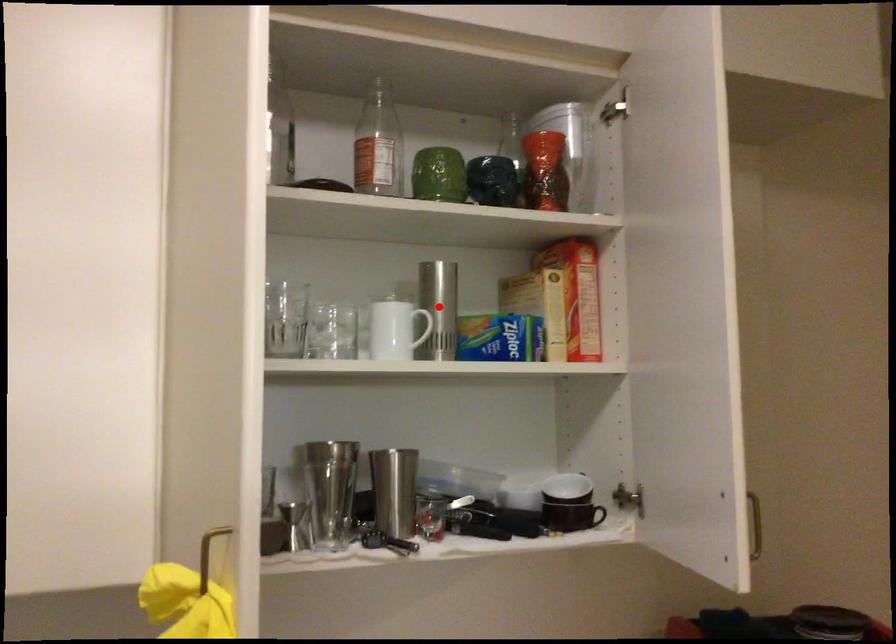
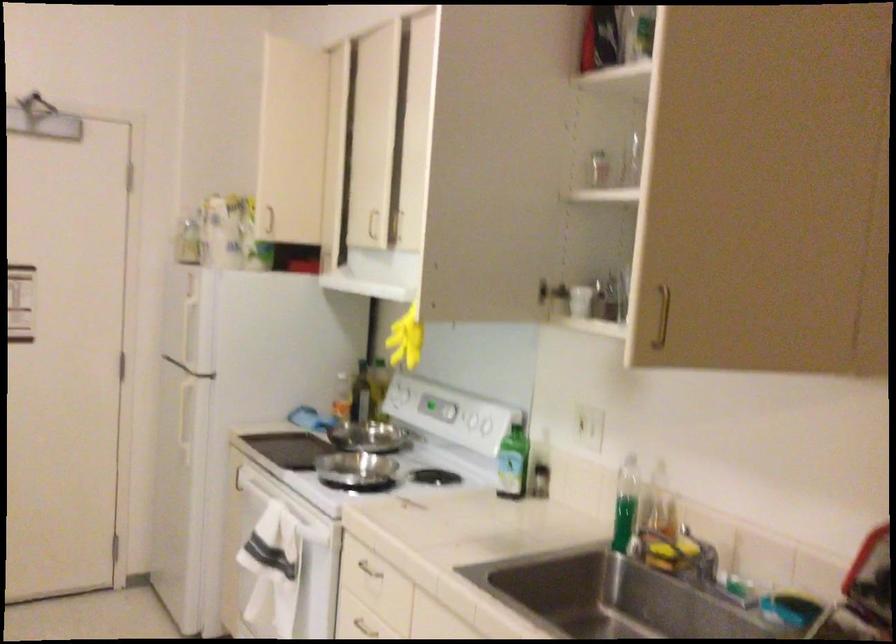
Question: I am providing you with two images of the same scene from different viewpoints. A red point is marked on the first image. At the location where the point appears in image 1, is it still visible in image 2?

Choices:
 (A) Yes
 (B) No

Answer: (B)